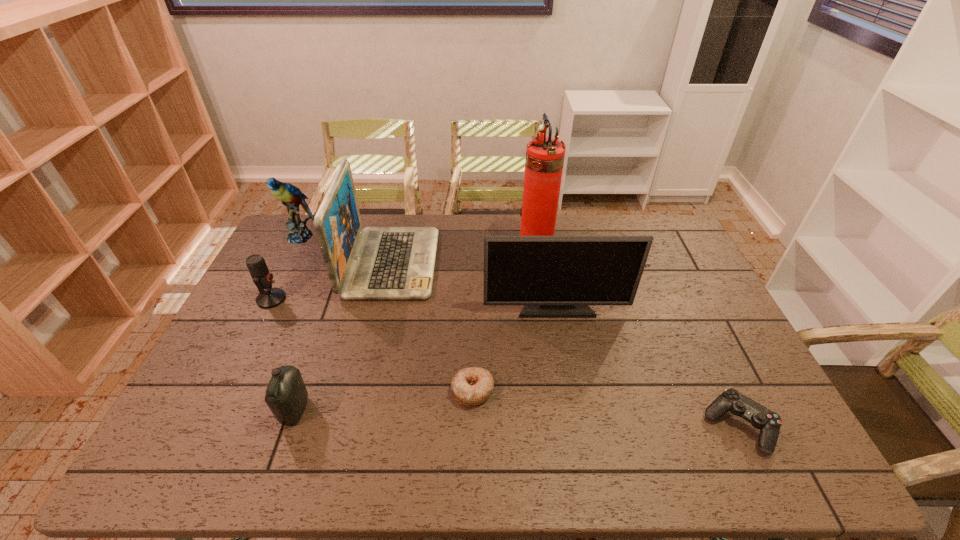
Where is `free location located 0.080m at the discharge end of the fire extinguisher`? The height and width of the screenshot is (540, 960). free location located 0.080m at the discharge end of the fire extinguisher is located at coordinates (492, 249).

You are a GUI agent. You are given a task and a screenshot of the screen. Output one action in this format:
    pyautogui.click(x=<x>, y=<y>)
    Task: Click on the free space located at the discharge end of the fire extinguisher
    The width and height of the screenshot is (960, 540).
    Given the screenshot: What is the action you would take?
    pyautogui.click(x=453, y=249)

At what (x,y) coordinates should I click in order to perform the action: click on vacant region located on the screen of the laptop computer. Please return your answer as a coordinate pair (x, y). Looking at the image, I should click on (464, 263).

Find the location of a particular element. The width and height of the screenshot is (960, 540). vacant space located 0.340m on the screen side of the monitor is located at coordinates (575, 418).

You are a GUI agent. You are given a task and a screenshot of the screen. Output one action in this format:
    pyautogui.click(x=<x>, y=<y>)
    Task: Click on the blank space located on the face of the parrot
    This screenshot has height=540, width=960.
    Given the screenshot: What is the action you would take?
    pyautogui.click(x=258, y=320)

Find the location of a particular element. The height and width of the screenshot is (540, 960). vacant space located on the side of the microphone with the red ring is located at coordinates (394, 299).

Locate an element on the screen. free point located 0.050m on the right of the bottle is located at coordinates (328, 410).

The height and width of the screenshot is (540, 960). What are the coordinates of `free space located 0.190m on the left of the control` in the screenshot? It's located at (630, 426).

Locate an element on the screen. vacant area located 0.130m on the back of the shortest object is located at coordinates (473, 336).

At what (x,y) coordinates should I click in order to perform the action: click on fire extinguisher that is positioned at the far edge. Please return your answer as a coordinate pair (x, y). This screenshot has width=960, height=540. Looking at the image, I should click on (544, 161).